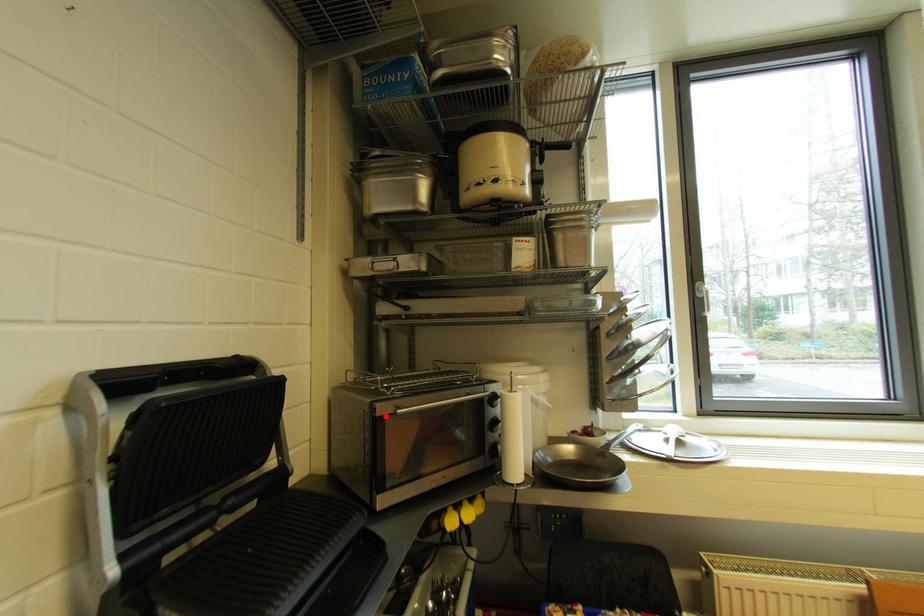
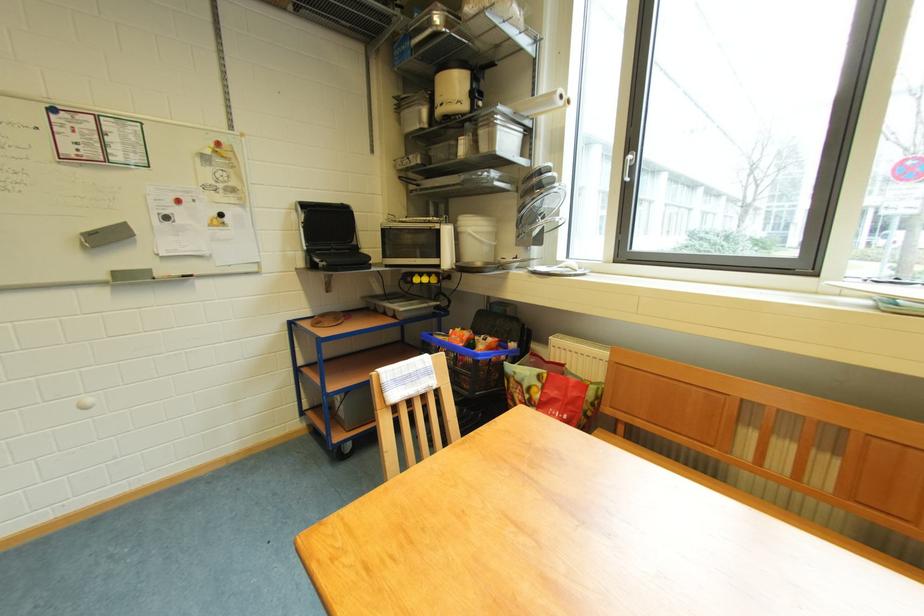
The point at the highlighted location is marked in the first image. Where is the corresponding point in the second image?

(390, 230)